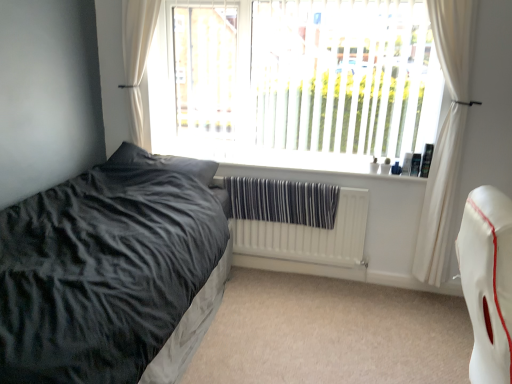
Where is `vacant area on top of white textured radiator at center (from a real-world perspective)`? The image size is (512, 384). vacant area on top of white textured radiator at center (from a real-world perspective) is located at coordinates (295, 182).